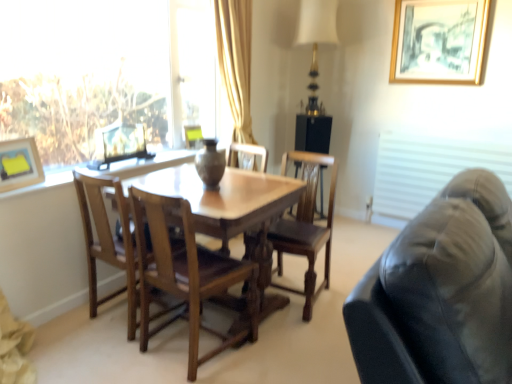
Identify the location of spots to the right of wooden chair at center, the 2th chair when ordered from left to right. The width and height of the screenshot is (512, 384). (282, 351).